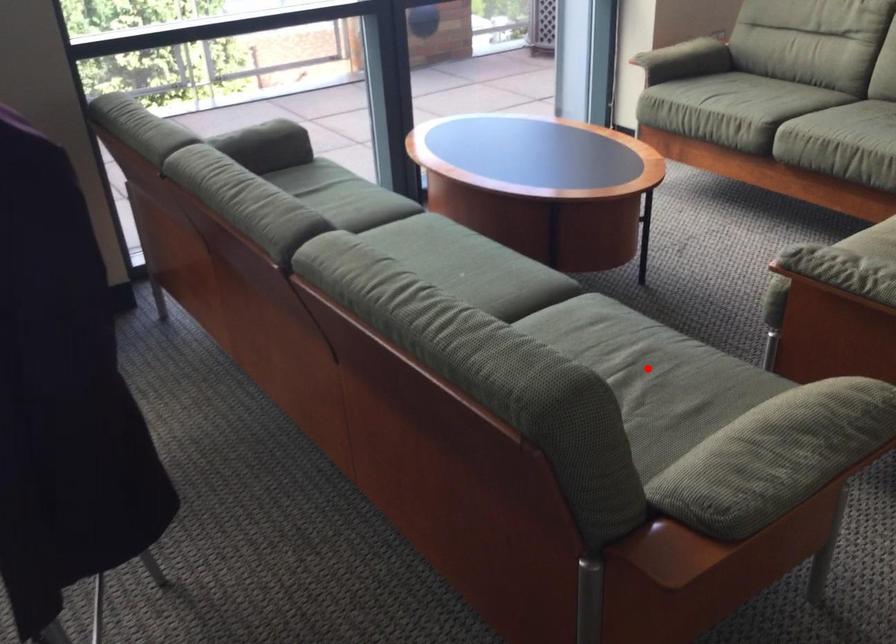
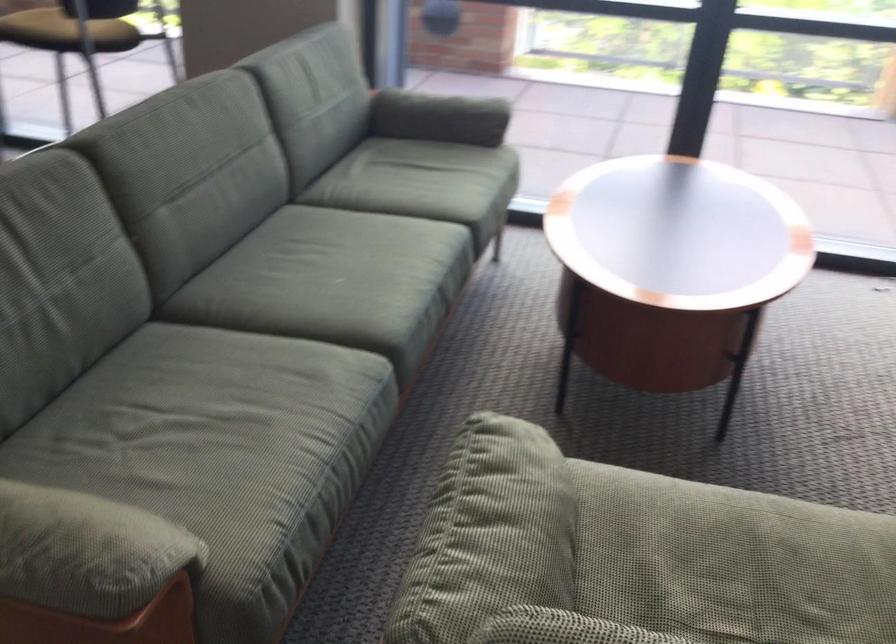
Locate, in the second image, the point that corresponds to the highlighted location in the first image.

(225, 430)